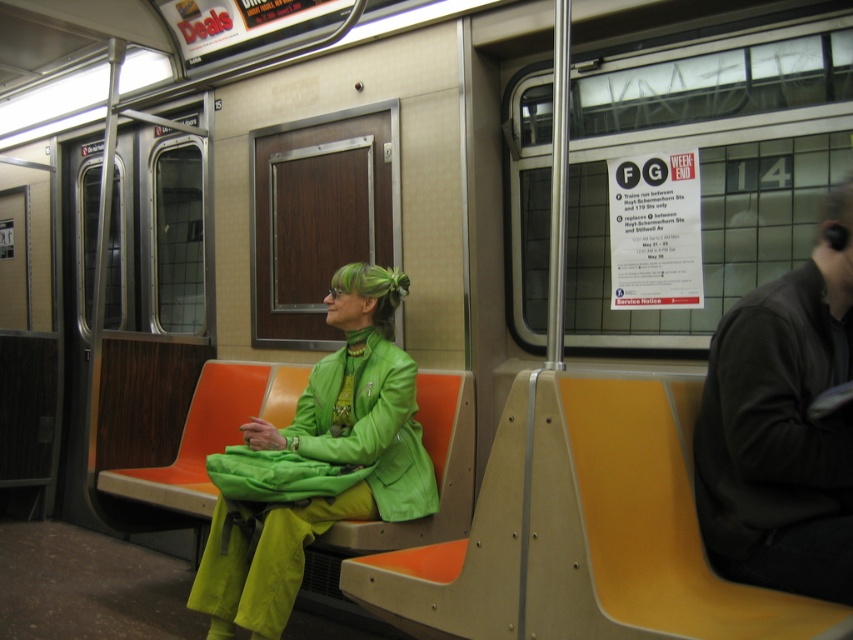
Question: Can you confirm if dark gray leather jacket at right is positioned above green matte jacket at center?

Choices:
 (A) no
 (B) yes

Answer: (B)

Question: Which of the following is the farthest from the observer?

Choices:
 (A) dark gray leather jacket at right
 (B) green matte jacket at center

Answer: (B)

Question: Among these objects, which one is nearest to the camera?

Choices:
 (A) dark gray leather jacket at right
 (B) green matte jacket at center

Answer: (A)

Question: Does dark gray leather jacket at right have a greater width compared to green matte jacket at center?

Choices:
 (A) no
 (B) yes

Answer: (A)

Question: Can you confirm if dark gray leather jacket at right is smaller than green matte jacket at center?

Choices:
 (A) yes
 (B) no

Answer: (A)